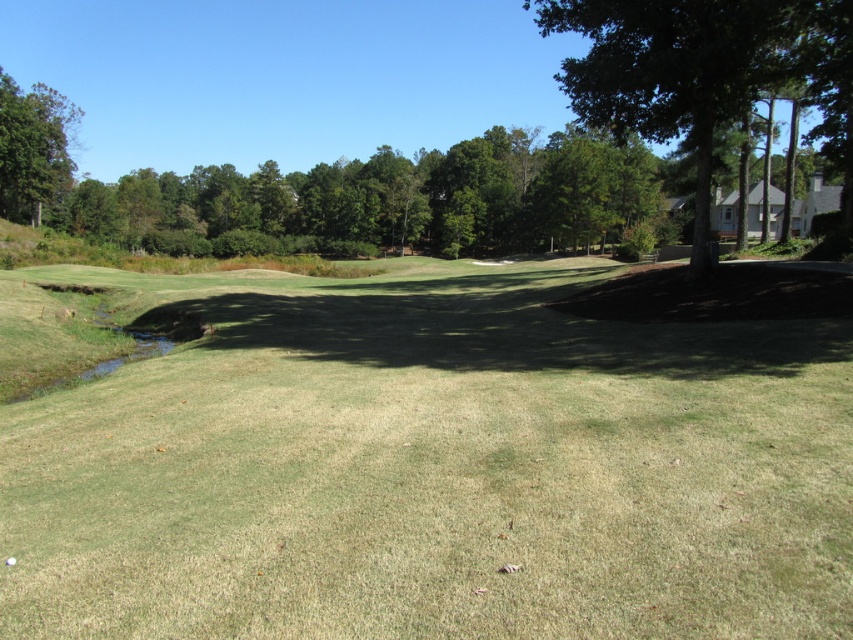
Measure the distance between green grass at center and green leafy tree at upper right.

green grass at center is 15.74 meters from green leafy tree at upper right.

Between point (363, 289) and point (589, 115), which one is positioned behind?

The point (363, 289) is behind.

Who is more forward, (131,493) or (831,20)?

Point (131,493) is more forward.

I want to click on green grass at center, so click(x=434, y=468).

Who is shorter, green grass at center or green leafy tree at upper left?

With less height is green grass at center.

Does point (741, 577) lie behind point (61, 173)?

No, it is not.

Where is `green grass at center`? The height and width of the screenshot is (640, 853). green grass at center is located at coordinates (434, 468).

Is green leafy tree at upper right to the left of green leafy tree at upper left from the viewer's perspective?

In fact, green leafy tree at upper right is to the right of green leafy tree at upper left.

Who is taller, green leafy tree at upper right or green leafy tree at upper left?

green leafy tree at upper right

I want to click on green leafy tree at upper right, so click(x=699, y=68).

This screenshot has width=853, height=640. I want to click on green leafy tree at upper right, so click(x=699, y=68).